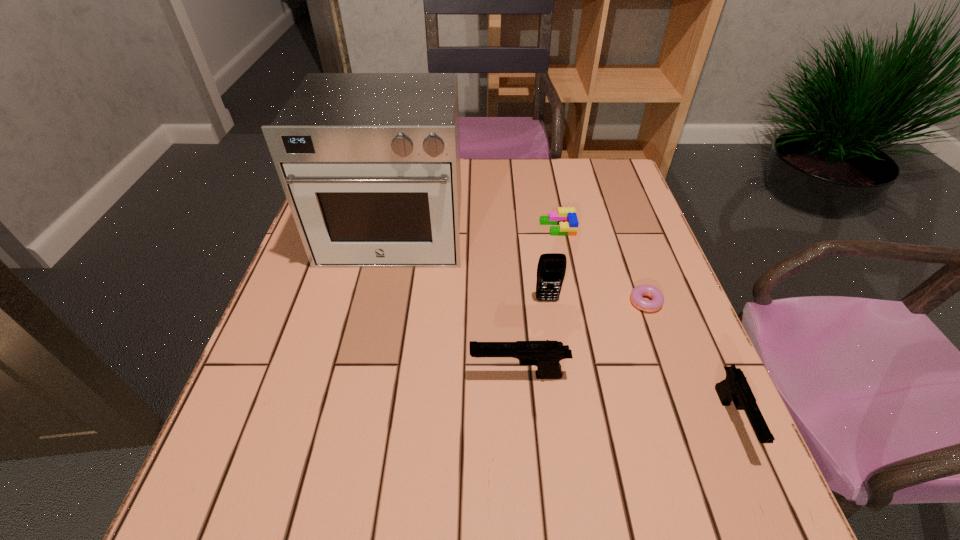
Please show where to add a pistol on the left while keeping spacing even. Please provide its 2D coordinates. Your answer should be formatted as a tuple, i.e. [(x, y)], where the tuple contains the x and y coordinates of a point satisfying the conditions above.

[(335, 337)]